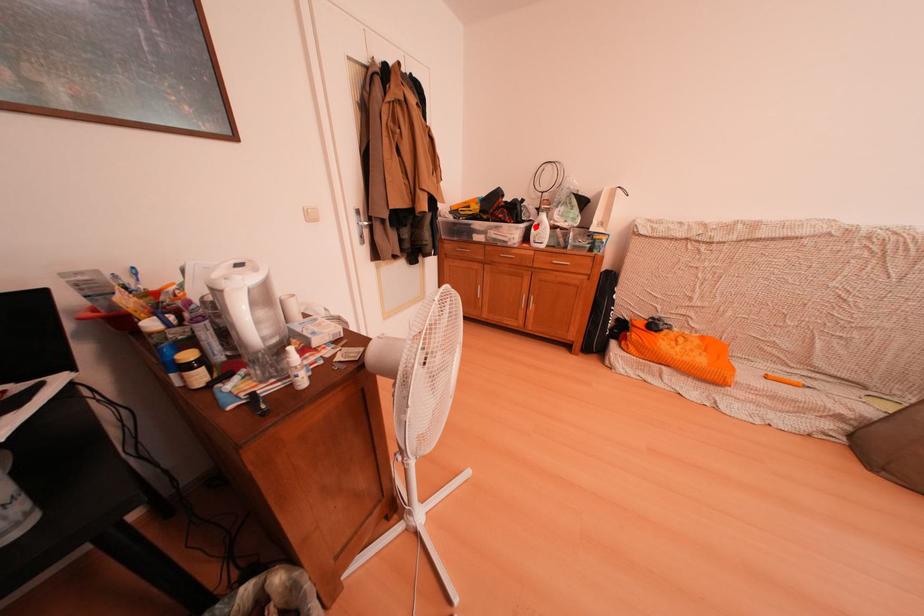
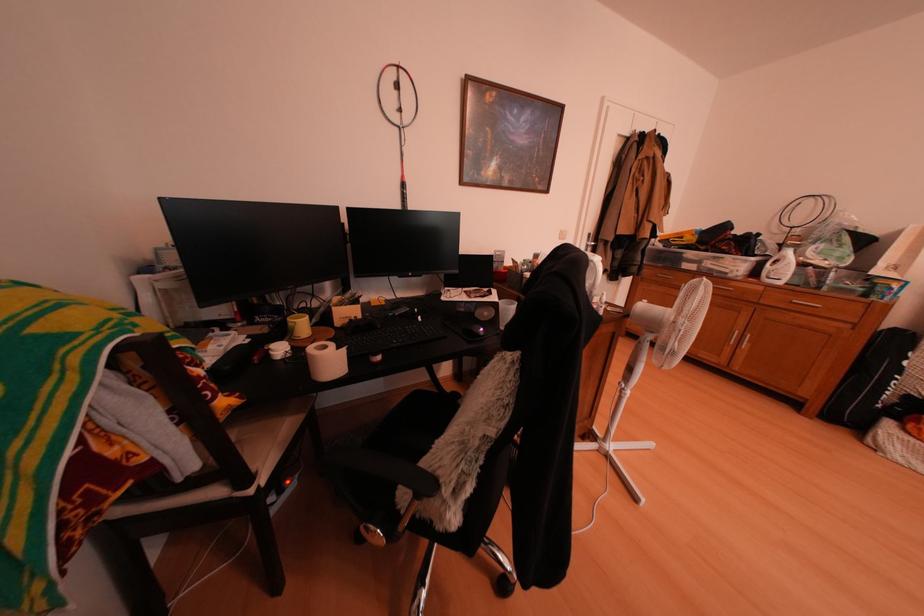
Question: I am providing you with two images of the same scene from different viewpoints. Image1 has a red point marked. In image2, the corresponding 3D location appears at what relative position? Reply with the corresponding letter.

Choices:
 (A) Closer
 (B) Farther

Answer: (B)